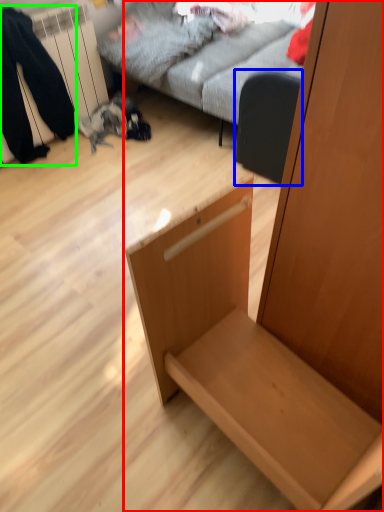
Question: Estimate the real-world distances between objects in this image. Which object is closer to furniture (highlighted by a red box), swivel chair (highlighted by a blue box) or couple (highlighted by a green box)?

Choices:
 (A) swivel chair
 (B) couple

Answer: (A)